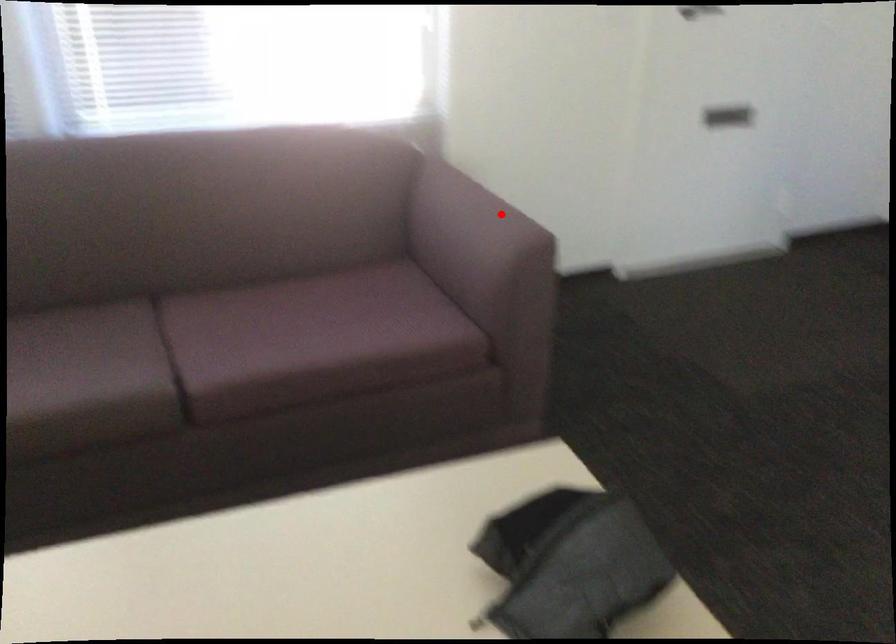
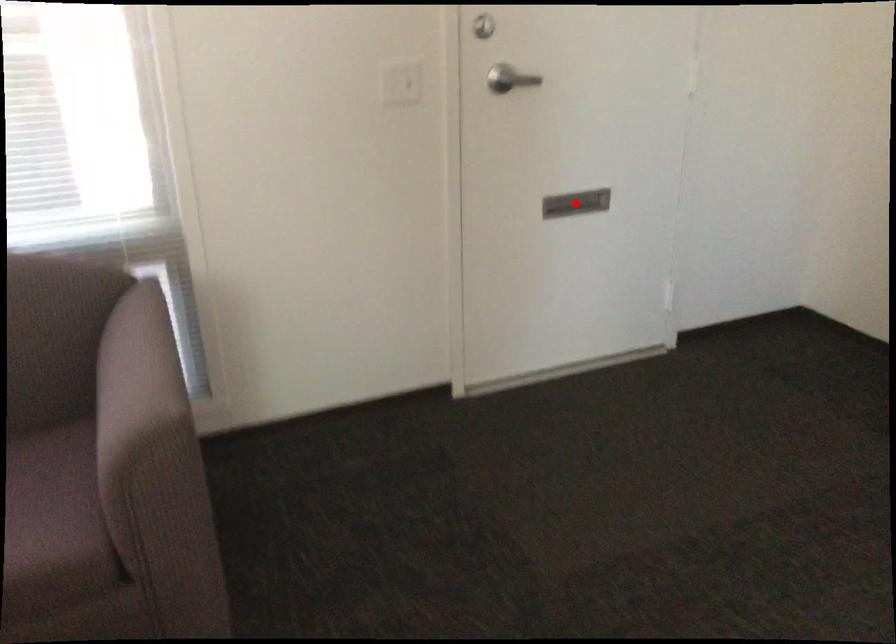
I am providing you with two images of the same scene from different viewpoints. A red point is marked on the first image and another point is marked on the second image. Is the marked point in image1 the same physical position as the marked point in image2?

No